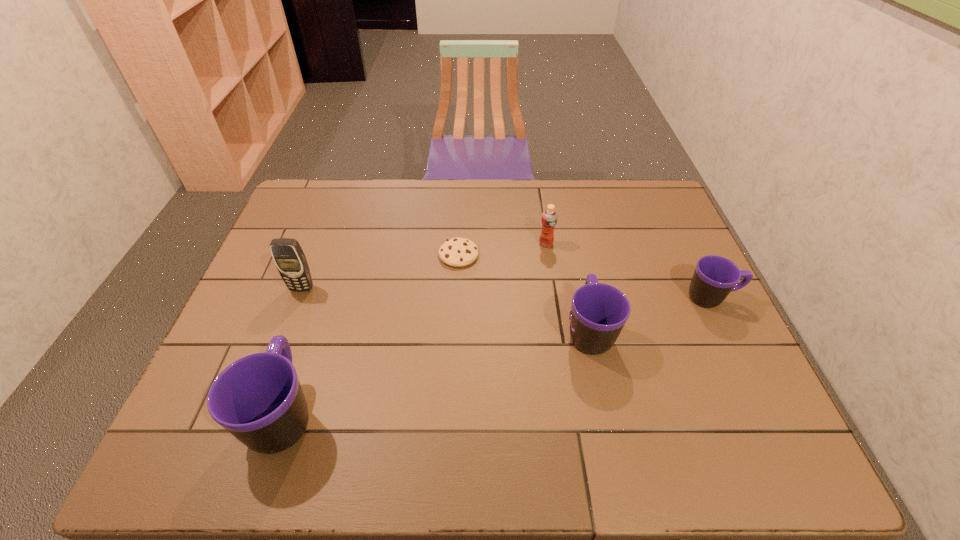
In order to click on the tallest mug in this screenshot , I will do `click(258, 398)`.

You are a GUI agent. You are given a task and a screenshot of the screen. Output one action in this format:
    pyautogui.click(x=<x>, y=<y>)
    Task: Click on the nearest object
    Image resolution: width=960 pixels, height=540 pixels.
    Given the screenshot: What is the action you would take?
    pyautogui.click(x=258, y=398)

Where is `the second mug from right to left`? This screenshot has height=540, width=960. the second mug from right to left is located at coordinates pos(599,311).

Where is `the fifth tallest object`? The height and width of the screenshot is (540, 960). the fifth tallest object is located at coordinates (715, 277).

This screenshot has width=960, height=540. I want to click on the rightmost mug, so click(x=715, y=277).

Find the location of a particular element. orange juice is located at coordinates (549, 217).

At what (x,y) coordinates should I click in order to perform the action: click on cellular telephone. Please return your answer as a coordinate pair (x, y). The height and width of the screenshot is (540, 960). Looking at the image, I should click on (289, 258).

The image size is (960, 540). In order to click on cookie in this screenshot , I will do `click(457, 252)`.

Where is `the shortest object`? the shortest object is located at coordinates (457, 252).

You are a GUI agent. You are given a task and a screenshot of the screen. Output one action in this format:
    pyautogui.click(x=<x>, y=<y>)
    Task: Click on the vacant space located with the handle on the side of the tallest mug
    
    Given the screenshot: What is the action you would take?
    (x=336, y=258)